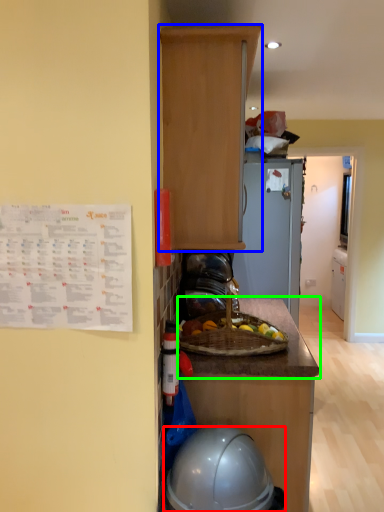
Question: Based on their relative distances, which object is farther from helmet (highlighted by a red box)? Choose from cabinetry (highlighted by a blue box) and countertop (highlighted by a green box).

Choices:
 (A) cabinetry
 (B) countertop

Answer: (A)